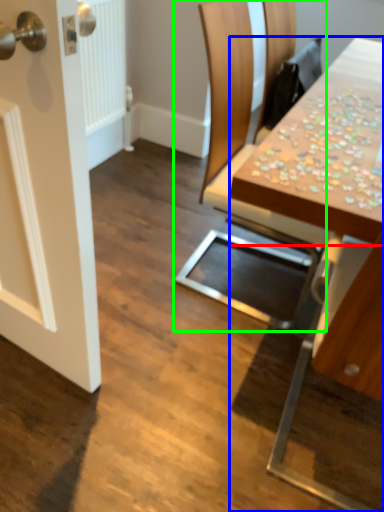
Question: Which object is positioned closest to counter top (highlighted by a red box)? Select from table (highlighted by a blue box) and chair (highlighted by a green box).

Choices:
 (A) table
 (B) chair

Answer: (A)